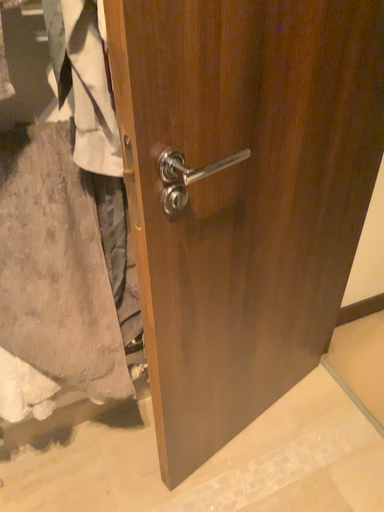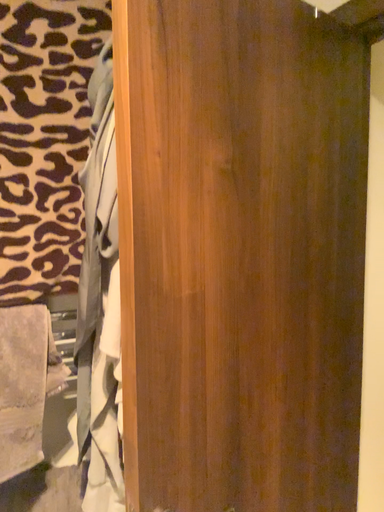
Question: How did the camera likely rotate when shooting the video?

Choices:
 (A) rotated downward
 (B) rotated upward

Answer: (B)